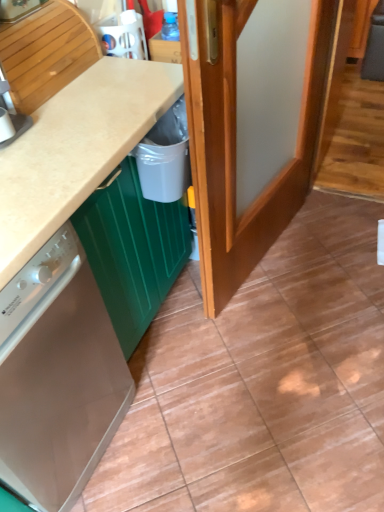
Locate an element on the screen. Image resolution: width=384 pixels, height=512 pixels. empty space that is to the right of beige matte countertop at center is located at coordinates (264, 333).